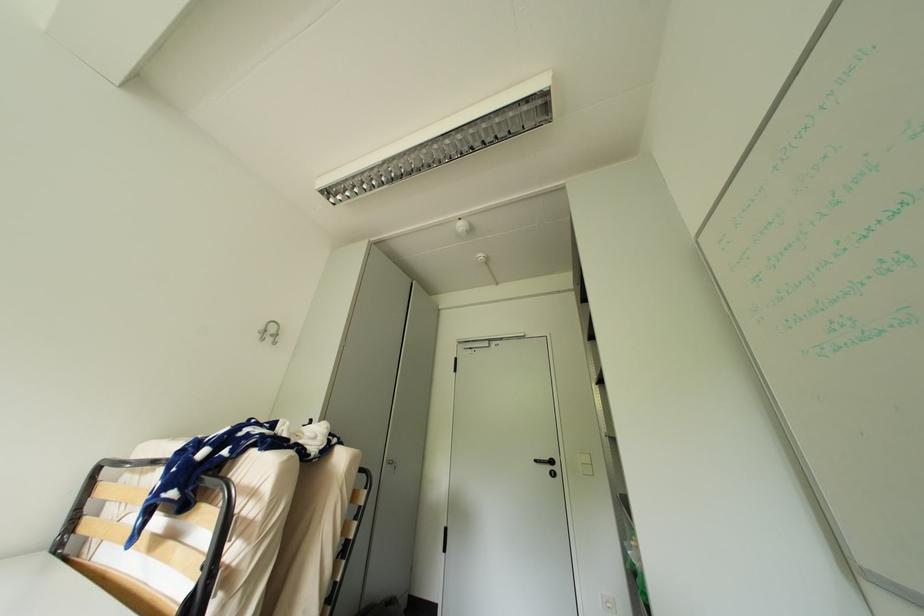
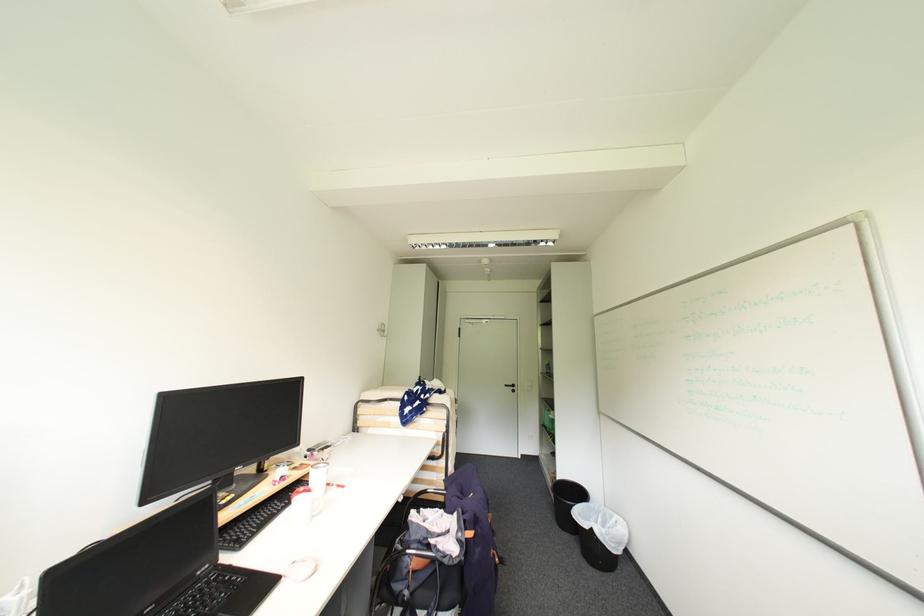
In the second image, find the point that corresponds to point (542, 462) in the first image.

(513, 387)